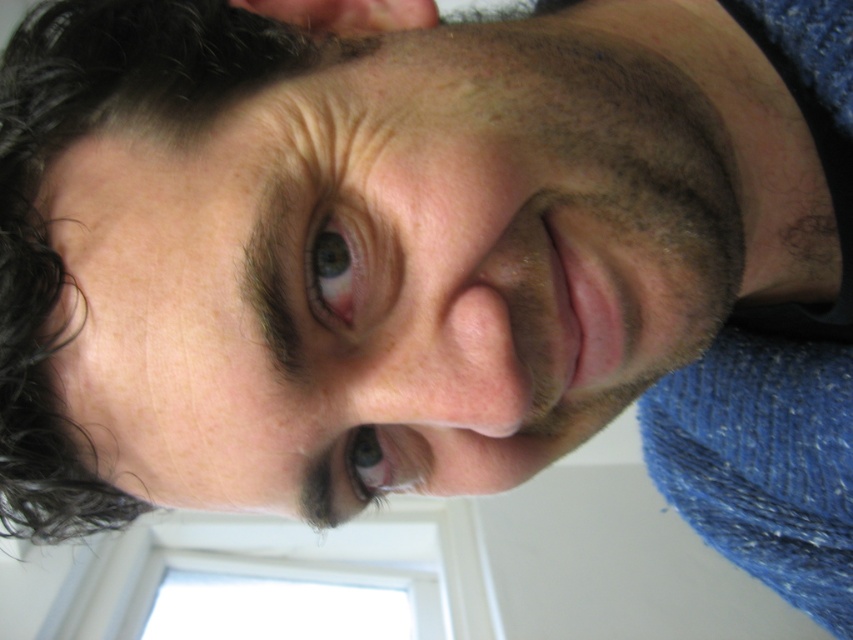
Question: Can you confirm if dark curly hair at upper left is positioned above brown matte eye at center?

Choices:
 (A) no
 (B) yes

Answer: (B)

Question: Does blue glossy eye at upper center have a lesser width compared to brown matte eye at center?

Choices:
 (A) no
 (B) yes

Answer: (B)

Question: Estimate the real-world distances between objects in this image. Which object is closer to the brown matte eye at center?

Choices:
 (A) smooth skin face at center
 (B) blue glossy eye at upper center
 (C) dark curly hair at upper left

Answer: (B)

Question: Estimate the real-world distances between objects in this image. Which object is closer to the brown matte eye at center?

Choices:
 (A) dark curly hair at upper left
 (B) blue glossy eye at upper center
 (C) smooth skin face at center

Answer: (B)

Question: Is smooth skin face at center behind blue glossy eye at upper center?

Choices:
 (A) no
 (B) yes

Answer: (A)

Question: Which of the following is the closest to the observer?

Choices:
 (A) (0, 440)
 (B) (680, 252)
 (C) (334, 310)
 (D) (368, 470)

Answer: (C)